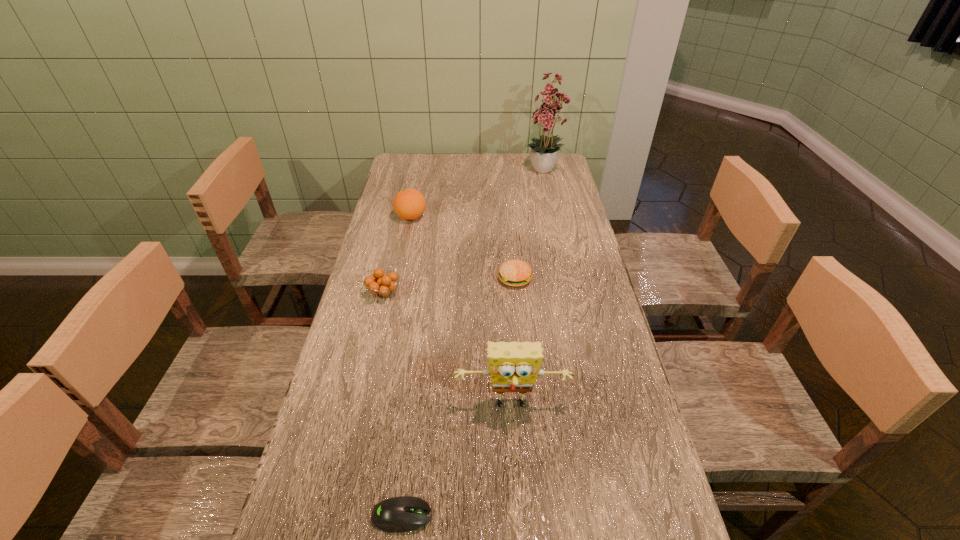
This screenshot has width=960, height=540. I want to click on the tallest object, so [543, 152].

Locate an element on the screen. flower arrangement is located at coordinates (543, 152).

At what (x,y) coordinates should I click in order to perform the action: click on the second nearest object. Please return your answer as a coordinate pair (x, y). Looking at the image, I should click on (514, 366).

At what (x,y) coordinates should I click in order to perform the action: click on the second tallest object. Please return your answer as a coordinate pair (x, y). Looking at the image, I should click on (514, 366).

Find the location of `the second farthest object`. the second farthest object is located at coordinates (409, 204).

Locate an element on the screen. the third tallest object is located at coordinates (409, 204).

Locate an element on the screen. The height and width of the screenshot is (540, 960). the third shortest object is located at coordinates (380, 284).

Where is `the nearer orange fruit`? the nearer orange fruit is located at coordinates (380, 284).

Identify the location of patty. (514, 272).

The image size is (960, 540). I want to click on the nearest object, so click(x=399, y=514).